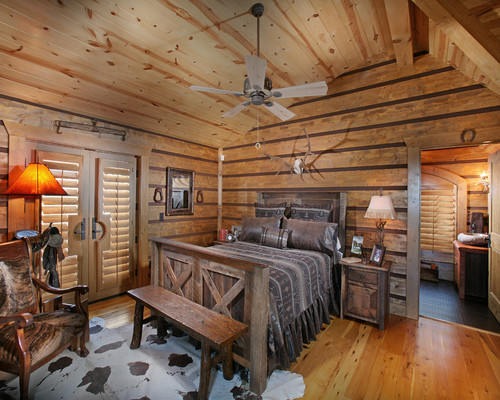
This screenshot has width=500, height=400. Find the location of `ceiling fan`. ceiling fan is located at coordinates (255, 87).